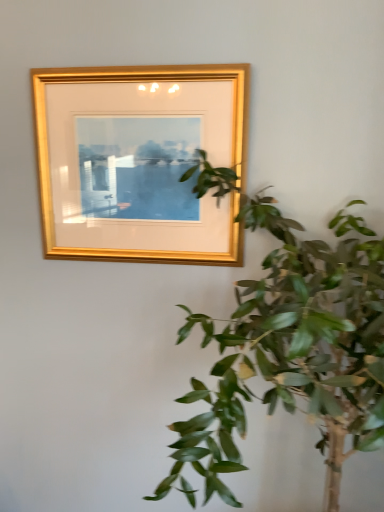
This screenshot has height=512, width=384. What do you see at coordinates (139, 161) in the screenshot?
I see `gold wood picture frame at upper center` at bounding box center [139, 161].

What are the coordinates of `gold wood picture frame at upper center` in the screenshot? It's located at (139, 161).

Locate an element on the screen. green leafy plant at upper right is located at coordinates (291, 353).

The height and width of the screenshot is (512, 384). Describe the element at coordinates (291, 353) in the screenshot. I see `green leafy plant at upper right` at that location.

Image resolution: width=384 pixels, height=512 pixels. Identify the location of gold wood picture frame at upper center. (139, 161).

Based on their positions, is green leafy plant at upper right located to the left or right of gold wood picture frame at upper center?

green leafy plant at upper right is to the right of gold wood picture frame at upper center.

Is green leafy plant at upper right further to camera compared to gold wood picture frame at upper center?

No, it is not.

Which is closer to the camera, (372, 247) or (200, 106)?

The point (372, 247) is more forward.

From the image's perspective, which is below, green leafy plant at upper right or gold wood picture frame at upper center?

green leafy plant at upper right appears lower in the image.

From a real-world perspective, does green leafy plant at upper right sit lower than gold wood picture frame at upper center?

Yes.

Can you confirm if green leafy plant at upper right is thinner than gold wood picture frame at upper center?

In fact, green leafy plant at upper right might be wider than gold wood picture frame at upper center.

Can you confirm if green leafy plant at upper right is shorter than gold wood picture frame at upper center?

In fact, green leafy plant at upper right may be taller than gold wood picture frame at upper center.

Does green leafy plant at upper right have a larger size compared to gold wood picture frame at upper center?

Yes, green leafy plant at upper right is bigger than gold wood picture frame at upper center.

Is green leafy plant at upper right situated inside gold wood picture frame at upper center or outside?

green leafy plant at upper right is outside gold wood picture frame at upper center.

Is green leafy plant at upper right far from gold wood picture frame at upper center?

No, green leafy plant at upper right is in close proximity to gold wood picture frame at upper center.

Is green leafy plant at upper right facing towards gold wood picture frame at upper center?

No, green leafy plant at upper right is not oriented towards gold wood picture frame at upper center.

What's the angular difference between green leafy plant at upper right and gold wood picture frame at upper center's facing directions?

The angle between the facing direction of green leafy plant at upper right and the facing direction of gold wood picture frame at upper center is 0.199 degrees.

Find the location of `houseplant on the right side of gold wood picture frame at upper center`. houseplant on the right side of gold wood picture frame at upper center is located at coordinates (291, 353).

Which is more to the right, gold wood picture frame at upper center or green leafy plant at upper right?

From the viewer's perspective, green leafy plant at upper right appears more on the right side.

Is gold wood picture frame at upper center positioned behind green leafy plant at upper right?

Yes, gold wood picture frame at upper center is further from the camera.

Is point (174, 227) closer to viewer compared to point (342, 212)?

That is False.

From the image's perspective, is gold wood picture frame at upper center above green leafy plant at upper right?

Correct, gold wood picture frame at upper center appears higher than green leafy plant at upper right in the image.

From a real-world perspective, is gold wood picture frame at upper center positioned under green leafy plant at upper right based on gravity?

No, from a real-world perspective, gold wood picture frame at upper center is not beneath green leafy plant at upper right.

Is gold wood picture frame at upper center wider or thinner than green leafy plant at upper right?

Considering their sizes, gold wood picture frame at upper center looks slimmer than green leafy plant at upper right.

Who is taller, gold wood picture frame at upper center or green leafy plant at upper right?

green leafy plant at upper right is taller.

Considering the sizes of objects gold wood picture frame at upper center and green leafy plant at upper right in the image provided, who is smaller, gold wood picture frame at upper center or green leafy plant at upper right?

Smaller between the two is gold wood picture frame at upper center.

Is gold wood picture frame at upper center positioned beyond the bounds of green leafy plant at upper right?

Absolutely, gold wood picture frame at upper center is external to green leafy plant at upper right.

Is gold wood picture frame at upper center next to green leafy plant at upper right and touching it?

gold wood picture frame at upper center and green leafy plant at upper right are not in contact.

Does gold wood picture frame at upper center turn towards green leafy plant at upper right?

No, gold wood picture frame at upper center is not aimed at green leafy plant at upper right.

Find the location of a particular element. This screenshot has width=384, height=512. houseplant beneath the gold wood picture frame at upper center (from a real-world perspective) is located at coordinates (291, 353).

Find the location of a particular element. This screenshot has height=512, width=384. houseplant in front of the gold wood picture frame at upper center is located at coordinates (291, 353).

This screenshot has width=384, height=512. Identify the location of picture frame above the green leafy plant at upper right (from a real-world perspective). (139, 161).